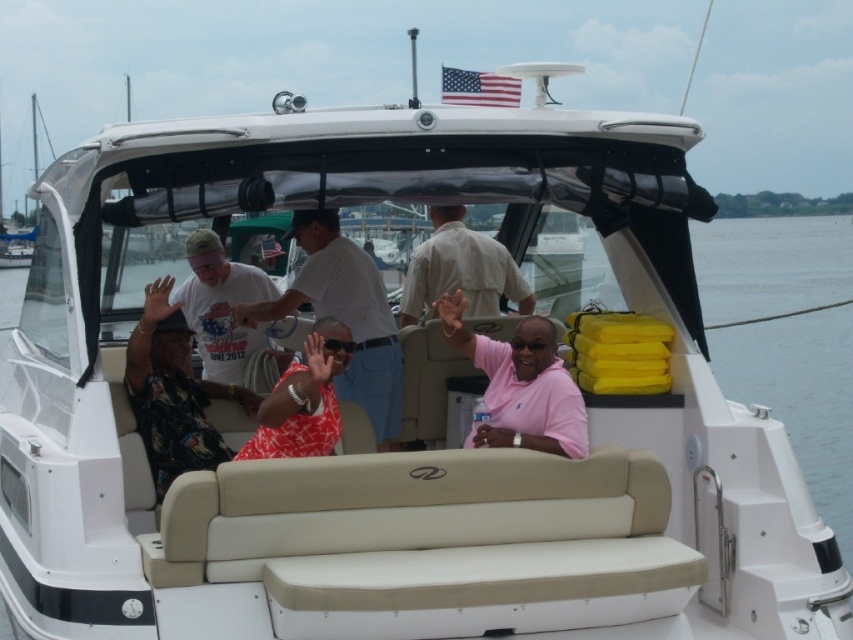
You are a photographer trying to capture the perfect shot of the white cotton shirt at center. Based on the scene, where should you position your camera to ensure the shirt is in the frame?

The white cotton shirt at center is located at the coordinates 0.494 on the x axis and 0.406 on the y axis, so positioning the camera to focus on those coordinates would ensure the shirt is centered in the frame.

You are a photographer taking a picture of the pink matte shirt at center and the yellow foam at right. Which object will be partially hidden in the photo?

The pink matte shirt at center will be partially hidden because it is positioned behind the yellow foam at right.